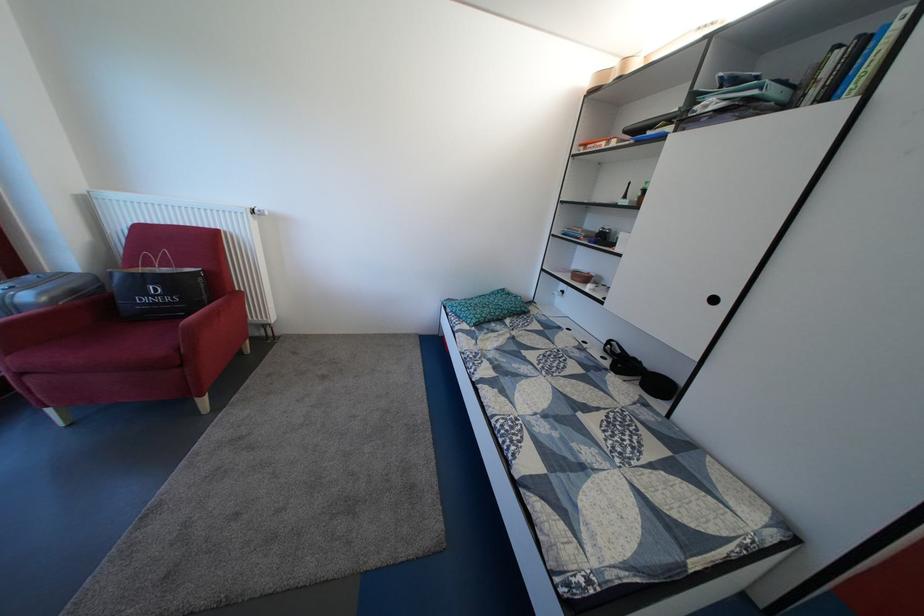
What do you see at coordinates (126, 347) in the screenshot?
I see `the red chair sitting surface` at bounding box center [126, 347].